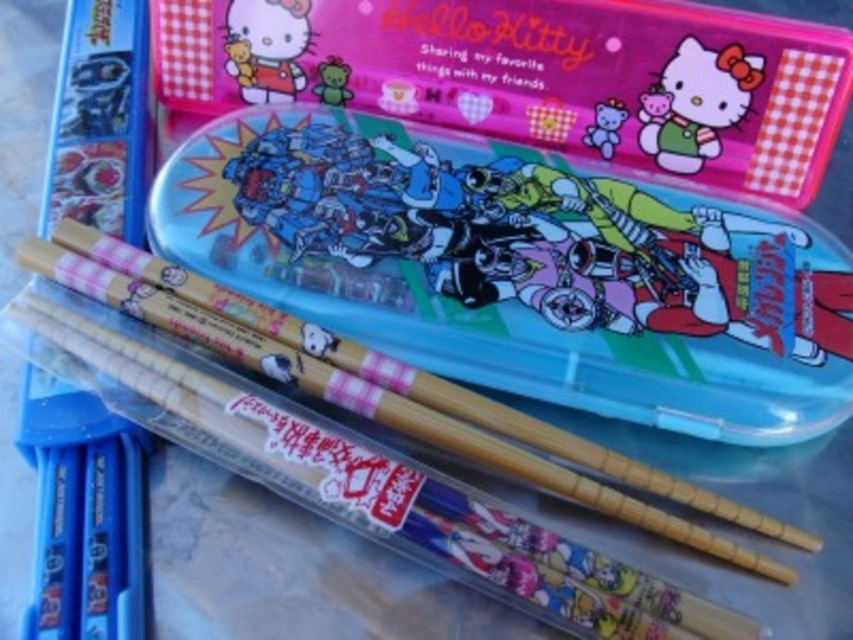
Question: Which object is the closest to the pink glossy hello kitty at upper center?

Choices:
 (A) translucent plastic lunch box at upper center
 (B) matte pink plush bear at upper center

Answer: (B)

Question: Based on their relative distances, which object is nearer to the matte pink bear at upper center?

Choices:
 (A) matte plastic chopsticks at lower left
 (B) matte pink plush bear at upper center

Answer: (B)

Question: Can you confirm if translucent plastic lunch box at upper center is positioned to the left of matte pink plush at upper right?

Choices:
 (A) no
 (B) yes

Answer: (B)

Question: Which is farther from the wooden chopsticks at center?

Choices:
 (A) matte pink bear at upper center
 (B) matte pink plush bear at upper center
 (C) translucent plastic lunch box at upper center
 (D) matte plastic chopsticks at lower left

Answer: (A)

Question: Can you confirm if translucent plastic lunch box at upper center is thinner than matte pink plush at upper right?

Choices:
 (A) yes
 (B) no

Answer: (B)

Question: Does matte plastic chopsticks at lower left appear over matte pink bear at upper center?

Choices:
 (A) yes
 (B) no

Answer: (A)